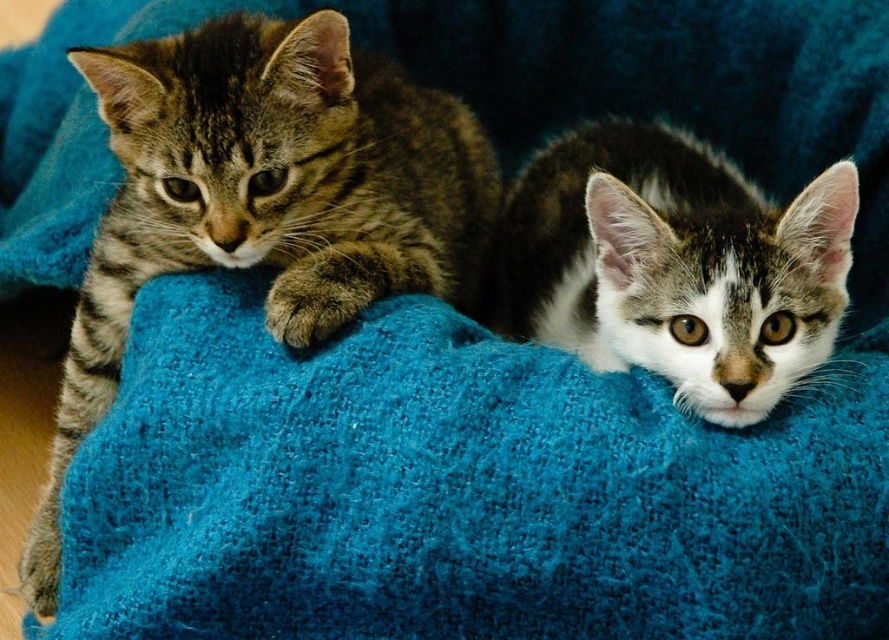
Question: Is turquoise woolen blanket at center positioned before tabby fur cat at center?

Choices:
 (A) no
 (B) yes

Answer: (B)

Question: Does turquoise woolen blanket at center appear under striped fur cat at left?

Choices:
 (A) yes
 (B) no

Answer: (A)

Question: Which of the following is the farthest from the observer?

Choices:
 (A) (x=167, y=348)
 (B) (x=135, y=273)
 (C) (x=607, y=205)

Answer: (B)

Question: Is turquoise woolen blanket at center thinner than tabby fur cat at center?

Choices:
 (A) no
 (B) yes

Answer: (A)

Question: Which object is closer to the camera taking this photo?

Choices:
 (A) striped fur cat at left
 (B) tabby fur cat at center

Answer: (B)

Question: Which point appears farthest from the camera in this image?

Choices:
 (A) (721, 170)
 (B) (391, 84)
 (C) (570, 481)

Answer: (A)